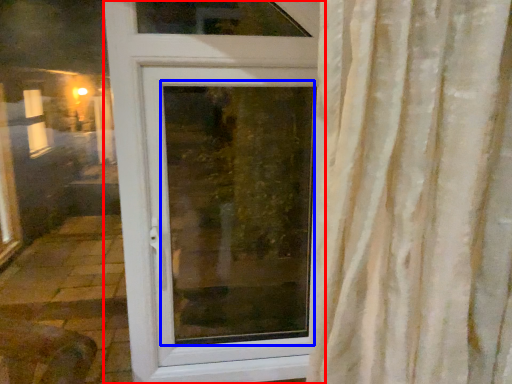
Question: Which object is closer to the camera taking this photo, door (highlighted by a red box) or window screen (highlighted by a blue box)?

Choices:
 (A) door
 (B) window screen

Answer: (A)